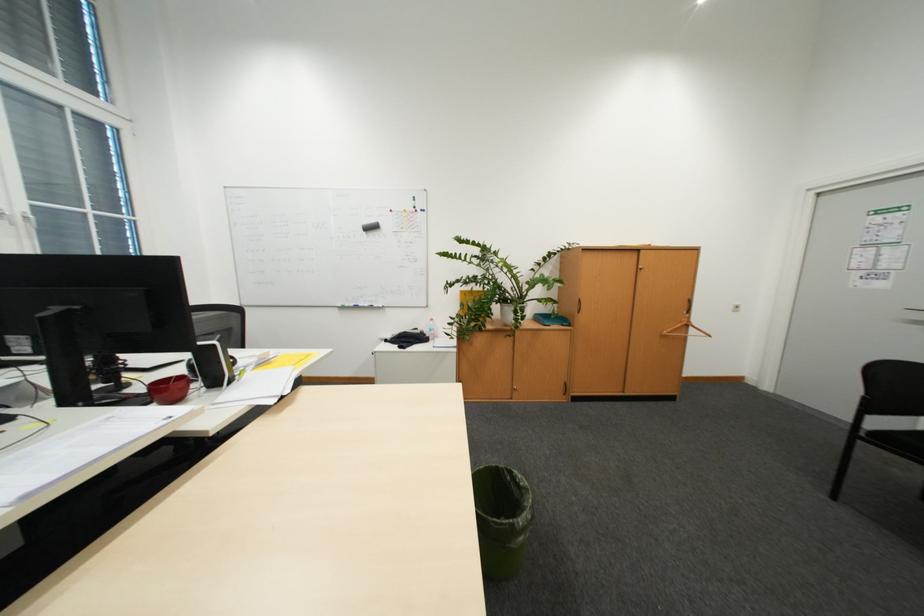
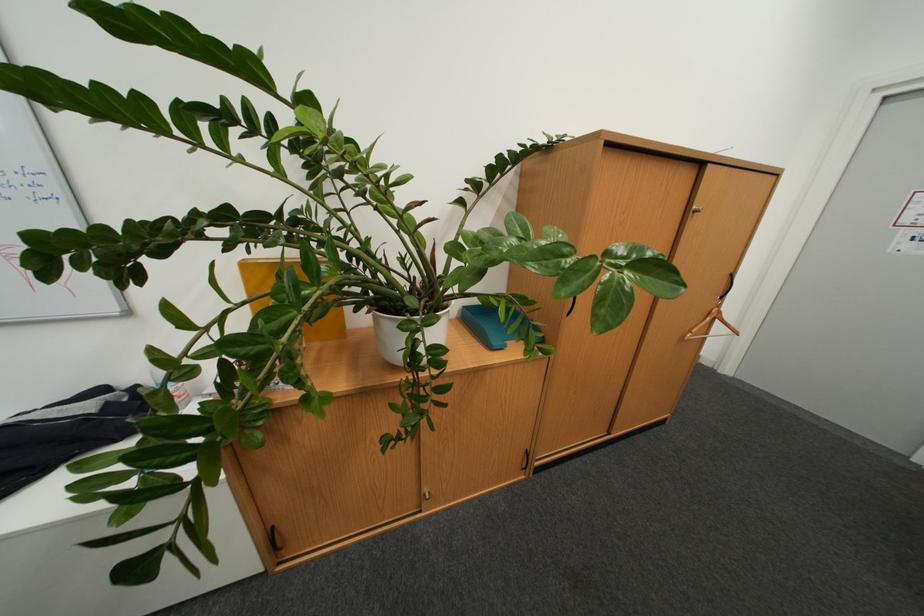
Question: What movement of the cameraman would produce the second image?

Choices:
 (A) Left
 (B) Right
 (C) Forward
 (D) Backward

Answer: (C)